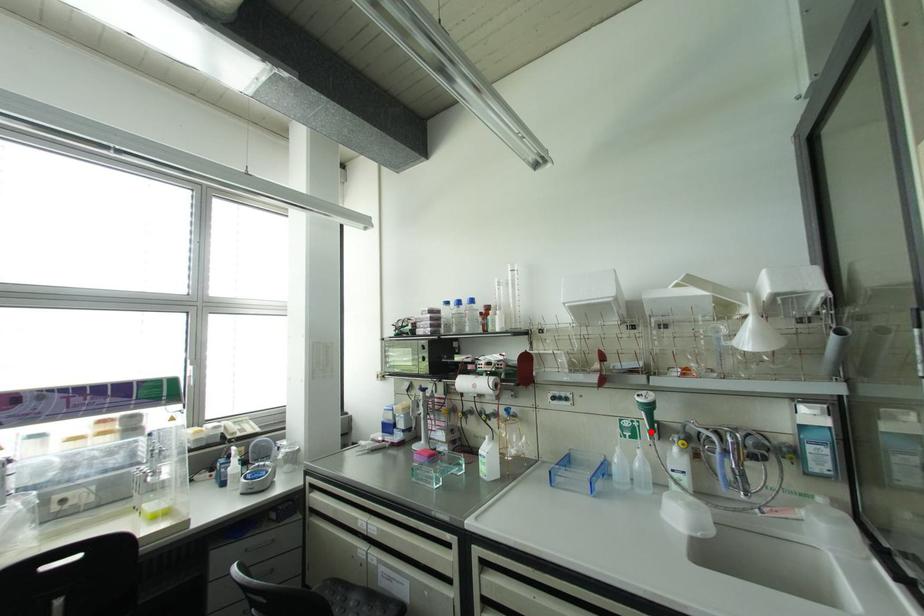
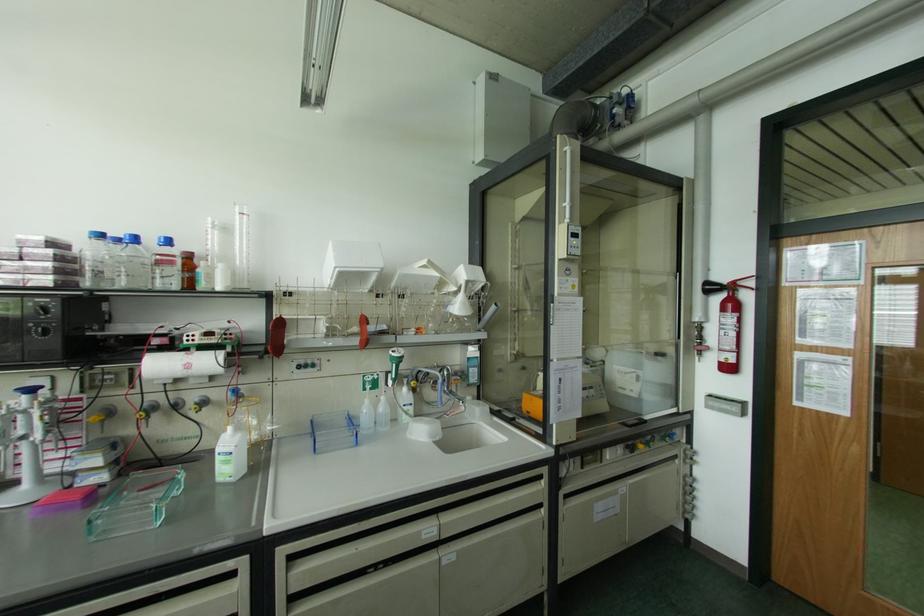
Question: I am providing you with two images of the same scene from different viewpoints. A red point is marked on the first image. Is the red point's position out of view in image 2?

Choices:
 (A) Yes
 (B) No

Answer: (B)